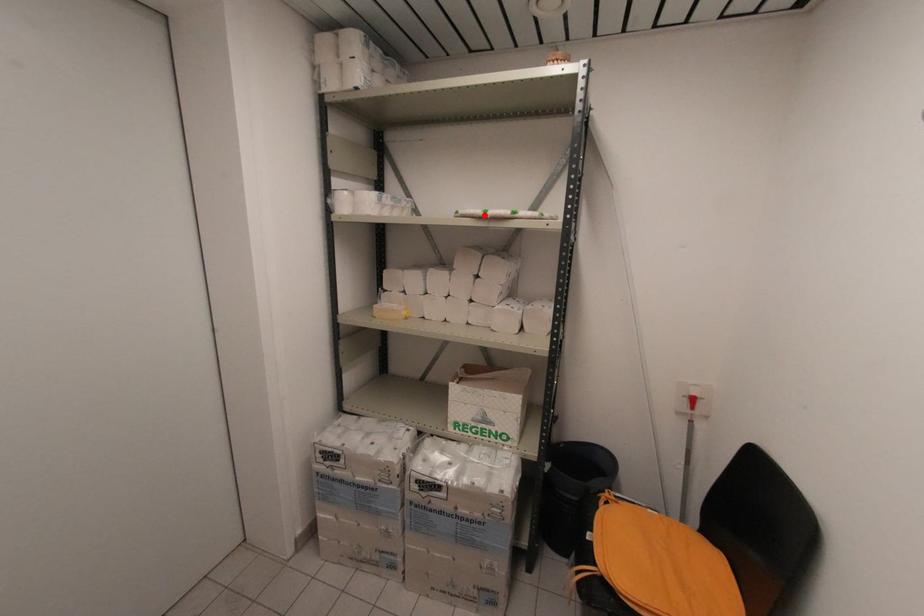
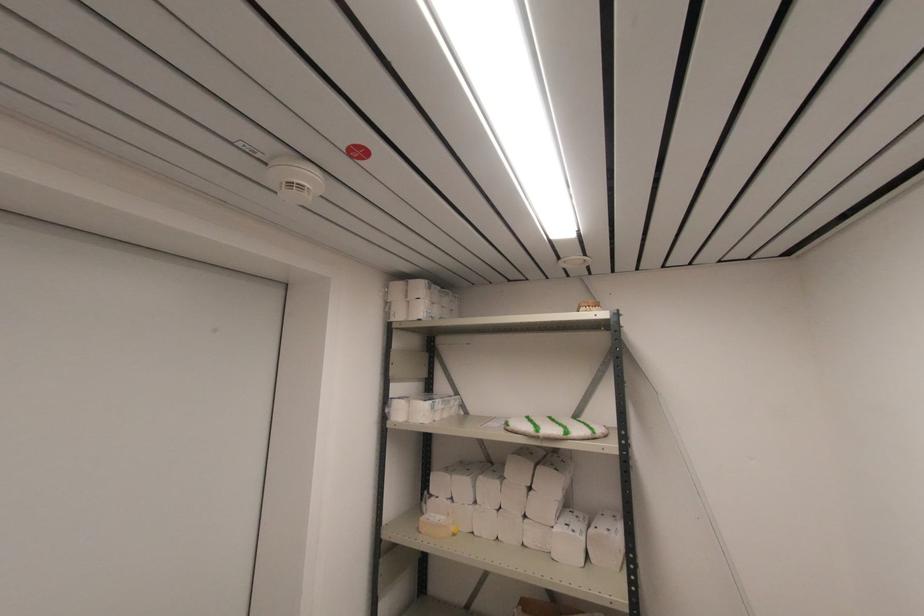
Locate, in the second image, the point that corresponds to the highlighted location in the first image.

(537, 436)